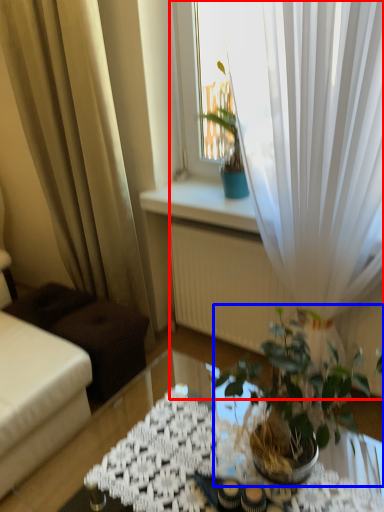
Question: Which object appears farthest to the camera in this image, curtain (highlighted by a red box) or houseplant (highlighted by a blue box)?

Choices:
 (A) curtain
 (B) houseplant

Answer: (A)